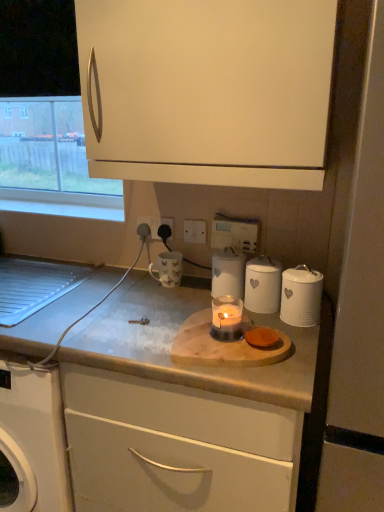
Question: Is translucent glass candle at center taller than white matte cabinet at upper center, which is the second cabinetry from bottom to top?

Choices:
 (A) no
 (B) yes

Answer: (A)

Question: Is translucent glass candle at center oriented away from white matte cabinet at upper center, which ranks as the 1th cabinetry in top-to-bottom order?

Choices:
 (A) yes
 (B) no

Answer: (B)

Question: Is translucent glass candle at center at the left side of white matte cabinet at upper center, which is the second cabinetry from bottom to top?

Choices:
 (A) yes
 (B) no

Answer: (B)

Question: From a real-world perspective, is translucent glass candle at center on white matte cabinet at upper center, which is the second cabinetry from bottom to top?

Choices:
 (A) yes
 (B) no

Answer: (B)

Question: Does translucent glass candle at center come behind white matte cabinet at upper center, which is the second cabinetry from bottom to top?

Choices:
 (A) no
 (B) yes

Answer: (B)

Question: Can you confirm if translucent glass candle at center is shorter than white matte cabinet at upper center, which ranks as the 1th cabinetry in top-to-bottom order?

Choices:
 (A) yes
 (B) no

Answer: (A)

Question: From a real-world perspective, is white matte screen door at right located higher than clear glass window at upper left?

Choices:
 (A) yes
 (B) no

Answer: (B)

Question: Would you consider white matte screen door at right to be distant from clear glass window at upper left?

Choices:
 (A) yes
 (B) no

Answer: (A)

Question: Is the position of white matte screen door at right less distant than that of clear glass window at upper left?

Choices:
 (A) yes
 (B) no

Answer: (A)

Question: Does white matte screen door at right contain clear glass window at upper left?

Choices:
 (A) no
 (B) yes

Answer: (A)

Question: Considering the relative sizes of white matte screen door at right and clear glass window at upper left in the image provided, is white matte screen door at right taller than clear glass window at upper left?

Choices:
 (A) yes
 (B) no

Answer: (A)

Question: Does white matte screen door at right have a smaller size compared to clear glass window at upper left?

Choices:
 (A) yes
 (B) no

Answer: (B)

Question: Is clear glass window at upper left with wooden cutting board at center?

Choices:
 (A) yes
 (B) no

Answer: (B)